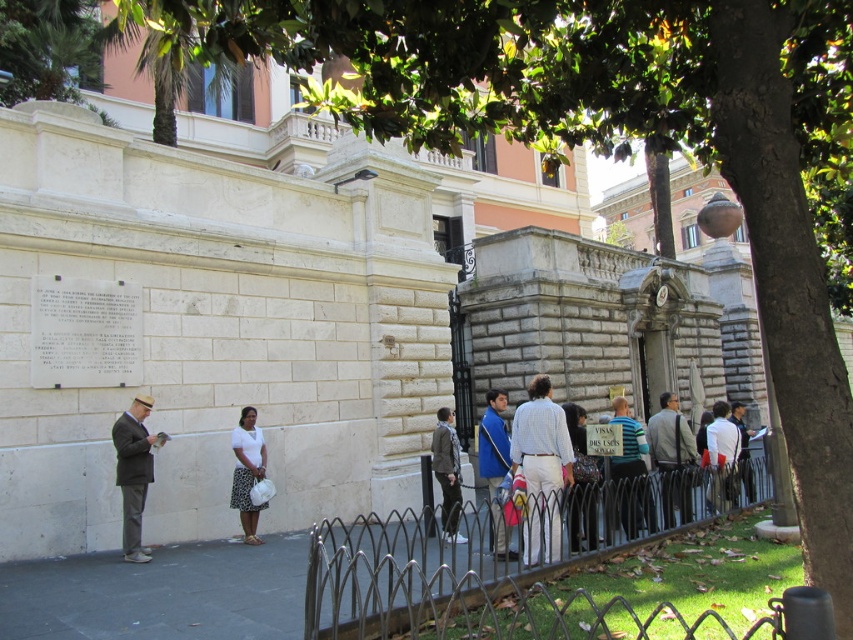
Who is more distant from viewer, (543, 486) or (144, 408)?

Positioned behind is point (144, 408).

Is point (531, 541) positioned before point (149, 458)?

Yes, it is.

At what (x,y) coordinates should I click in order to perform the action: click on white cotton shirt at center. Please return your answer as a coordinate pair (x, y). Looking at the image, I should click on (614, 477).

Can you confirm if metallic wire fence at center is positioned below gray wool coat at center?

Yes, metallic wire fence at center is below gray wool coat at center.

Between point (335, 520) and point (440, 435), which one is positioned behind?

The point (335, 520) is behind.

Between point (619, 544) and point (451, 449), which one is positioned in front?

Positioned in front is point (619, 544).

The image size is (853, 640). Identify the location of metallic wire fence at center. (392, 573).

Who is positioned more to the left, white cotton shirt at center or gray wool coat at center?

Positioned to the left is gray wool coat at center.

Does point (722, 444) come closer to viewer compared to point (456, 512)?

No, it is not.

Between point (598, 488) and point (451, 474), which one is positioned behind?

The point (451, 474) is more distant.

Image resolution: width=853 pixels, height=640 pixels. What are the coordinates of `white cotton shirt at center` in the screenshot? It's located at (614, 477).